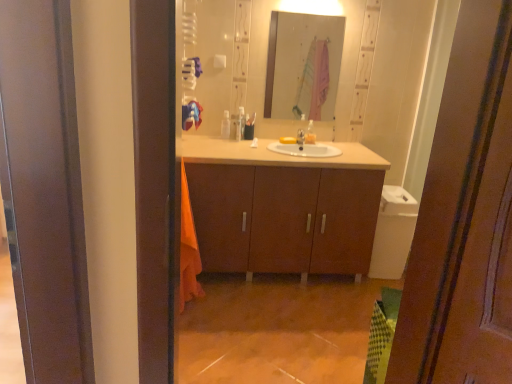
Question: From the image's perspective, relative to silver metallic tap at center, is matte wood cabinet at center above or below?

Choices:
 (A) below
 (B) above

Answer: (A)

Question: In terms of width, does matte wood cabinet at center look wider or thinner when compared to silver metallic tap at center?

Choices:
 (A) wide
 (B) thin

Answer: (A)

Question: Which is nearer to the translucent plastic toothbrush holder at center, the second toiletry from the right?

Choices:
 (A) orange cotton beach towel at left, acting as the 1th beach towel starting from the bottom
 (B) clear glass mirror at upper center
 (C) translucent plastic bag at center, arranged as the 3th toiletry when viewed from the left
 (D) white plastic container at center, which is counted as the 1th toiletry, starting from the left
 (E) blue fabric beach towel at center, arranged as the first beach towel when viewed from the top

Answer: (D)

Question: Which object is the closest to the blue fabric beach towel at center, the 2th beach towel positioned from the bottom?

Choices:
 (A) clear glass mirror at upper center
 (B) white plastic container at center, the 3th toiletry positioned from the right
 (C) silver metallic tap at center
 (D) orange cotton beach towel at left, acting as the 1th beach towel starting from the bottom
 (E) translucent plastic toothbrush holder at center, the second toiletry from the right

Answer: (B)